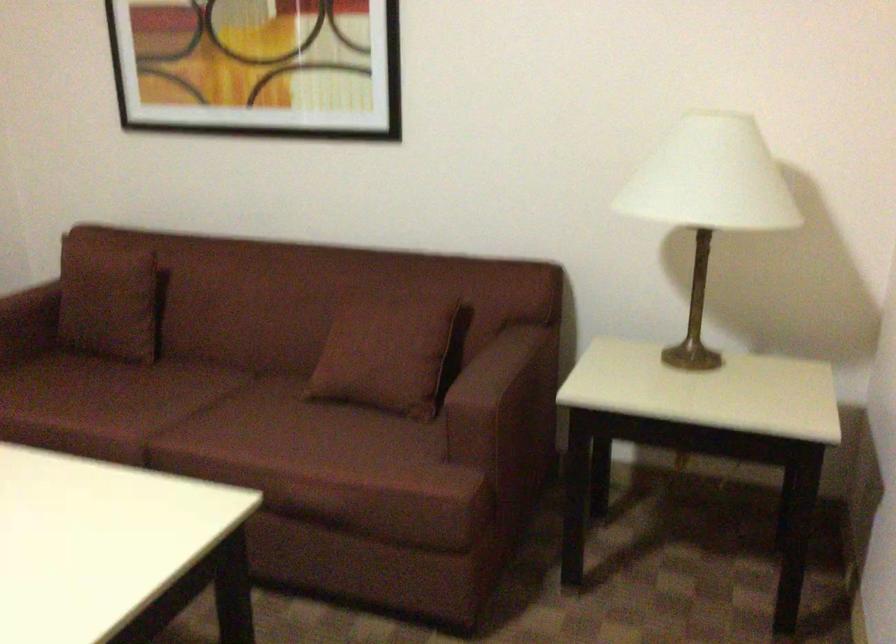
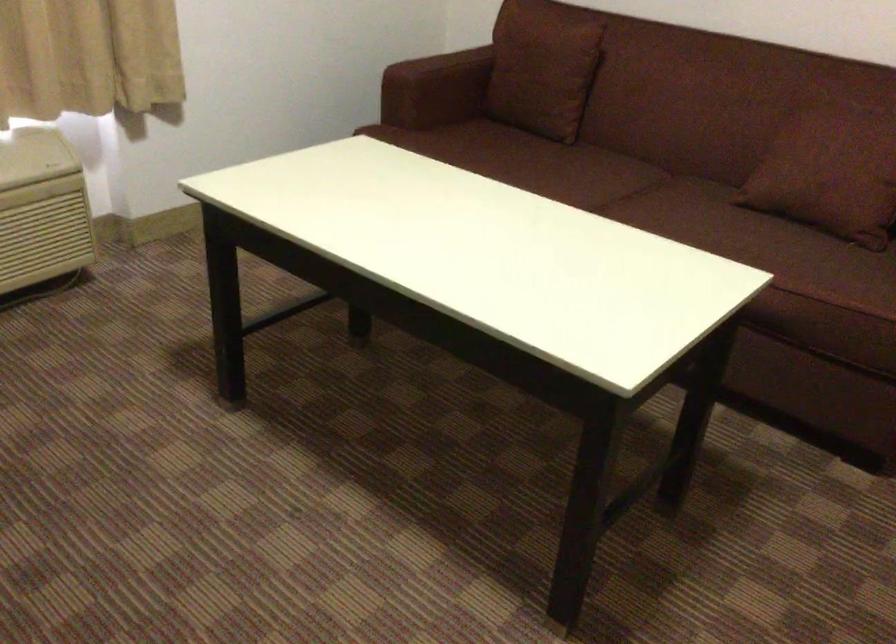
Locate, in the second image, the point that corresponds to [143,404] in the first image.

(574, 176)